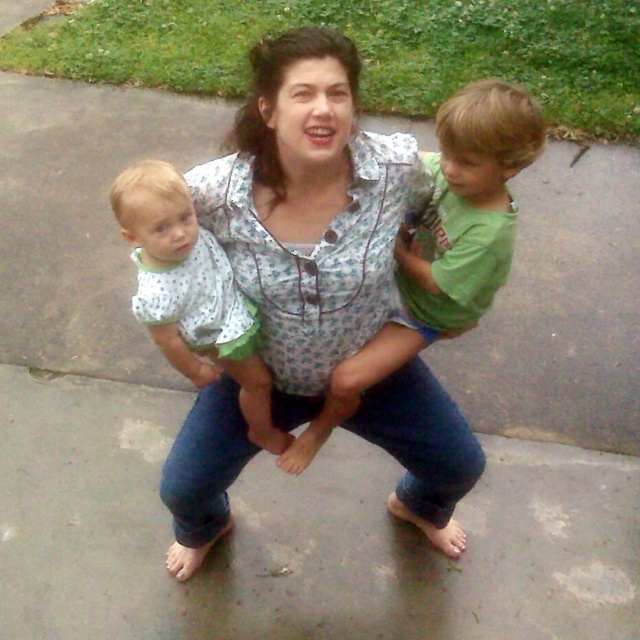
You are a photographer trying to capture a candid shot of the two children in the image. You want to ensure that both the floral shirt at center and the green cotton shirt at upper center are in focus. Given that your camera has a depth of field that can cover 8 inches, will you be able to achieve this?

The floral shirt at center is 8.44 inches from the green cotton shirt at upper center. Since the distance between them exceeds the camera s 8 inch depth of field, it may be challenging to keep both in focus simultaneously.

You are a photographer trying to capture a family photo. You notice the floral shirt at center and the polka dot fabric shirt at upper left in the scene. Which shirt should you focus on to ensure it appears larger in the final photo?

The floral shirt at center is much taller than the polka dot fabric shirt at upper left, so focusing on the floral shirt at center will ensure it appears larger in the final photo.

You are a photographer who wants to ensure that both shirts are visible in the photo. Given that the green cotton shirt at upper center and the polka dot fabric shirt at upper left are part of the scene, which shirt should you adjust to make sure both are fully visible?

Since the green cotton shirt at upper center is taller than the polka dot fabric shirt at upper left, you should lower the green cotton shirt at upper center to ensure both shirts are fully visible.